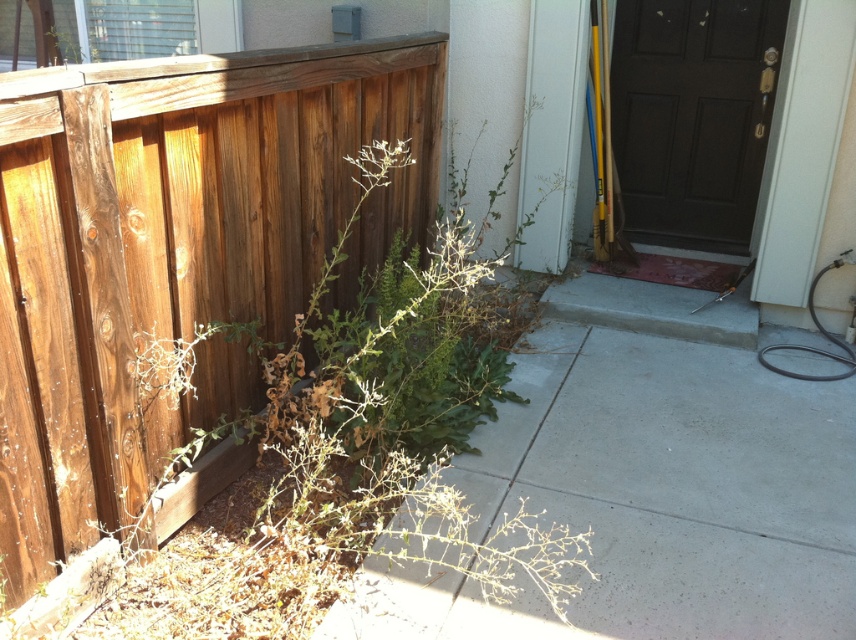
Is point (697, 6) positioned before point (819, 273)?

No, (697, 6) is further to viewer.

Which is behind, point (733, 88) or point (854, 356)?

Point (733, 88)

Is point (759, 81) less distant than point (782, 348)?

That is False.

Where is `dark wood door at center`? This screenshot has height=640, width=856. dark wood door at center is located at coordinates (693, 116).

From the picture: Can you confirm if weathered wood fence at left is positioned to the right of gray concrete pavement at lower center?

No, weathered wood fence at left is not to the right of gray concrete pavement at lower center.

Is weathered wood fence at left smaller than gray concrete pavement at lower center?

Actually, weathered wood fence at left might be larger than gray concrete pavement at lower center.

Is point (174, 64) more distant than point (753, 422)?

No, (174, 64) is closer to viewer.

Where is `weathered wood fence at left`? Image resolution: width=856 pixels, height=640 pixels. weathered wood fence at left is located at coordinates (175, 252).

Is gray concrete pavement at lower center shorter than dark wood door at center?

Indeed, gray concrete pavement at lower center has a lesser height compared to dark wood door at center.

Is point (649, 458) more distant than point (649, 196)?

No, (649, 458) is in front of (649, 196).

Image resolution: width=856 pixels, height=640 pixels. I want to click on gray concrete pavement at lower center, so click(x=651, y=499).